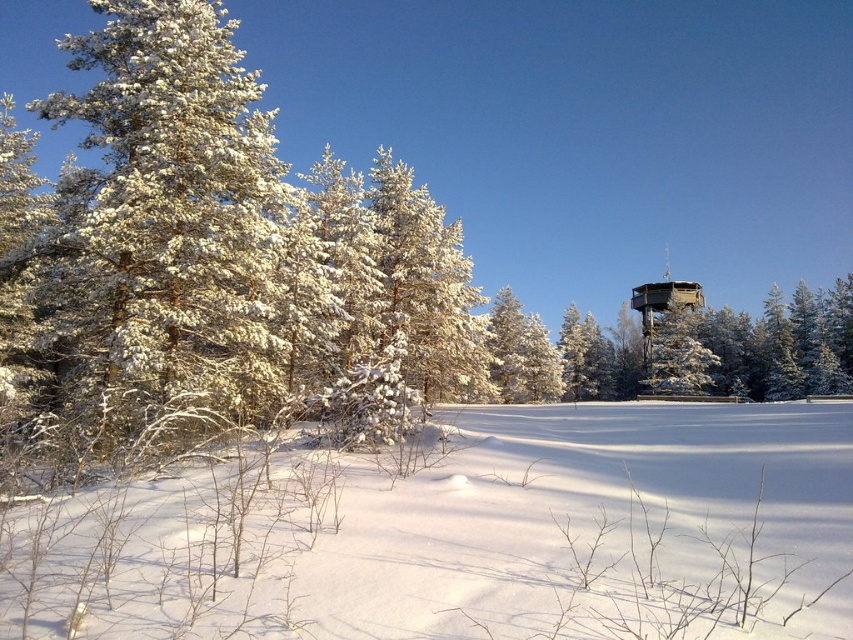
Question: Which of the following is the closest to the observer?

Choices:
 (A) (701, 346)
 (B) (206, 636)

Answer: (B)

Question: Can you confirm if white snow at center is wider than snow-covered wooden tower at center?

Choices:
 (A) yes
 (B) no

Answer: (A)

Question: Among these objects, which one is farthest from the camera?

Choices:
 (A) snow-covered wooden tower at center
 (B) white snow at center

Answer: (A)

Question: Can you confirm if white snow at center is smaller than snow-covered wooden tower at center?

Choices:
 (A) no
 (B) yes

Answer: (B)

Question: Does white snow at center appear on the right side of snow-covered wooden tower at center?

Choices:
 (A) no
 (B) yes

Answer: (A)